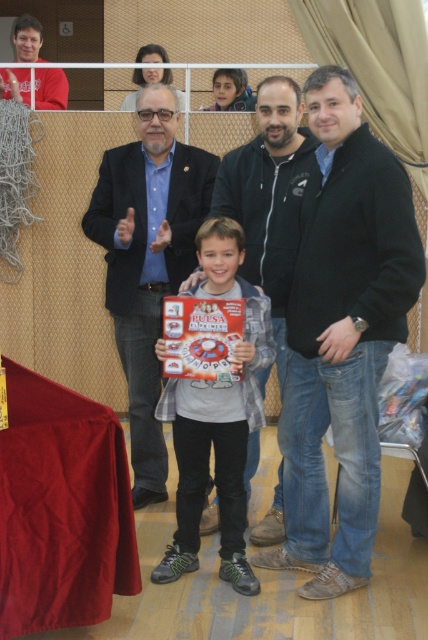
Question: From the image, what is the correct spatial relationship of matte plastic board game at center in relation to black fleece jacket at center?

Choices:
 (A) above
 (B) below

Answer: (B)

Question: Which object is positioned closest to the matte black jacket at center?

Choices:
 (A) black fleece jacket at center
 (B) black matte jacket at center
 (C) matte plastic board game at center

Answer: (A)

Question: Which point is closer to the camera?

Choices:
 (A) black fleece jacket at center
 (B) matte plastic board game at center
 (C) black matte jacket at center

Answer: (C)

Question: Is black matte jacket at center smaller than black fleece jacket at center?

Choices:
 (A) yes
 (B) no

Answer: (B)

Question: Which object is the closest to the matte plastic board game at center?

Choices:
 (A) matte black jacket at center
 (B) black fleece jacket at center

Answer: (B)

Question: Is black matte jacket at center to the left of matte plastic board game at center from the viewer's perspective?

Choices:
 (A) no
 (B) yes

Answer: (A)